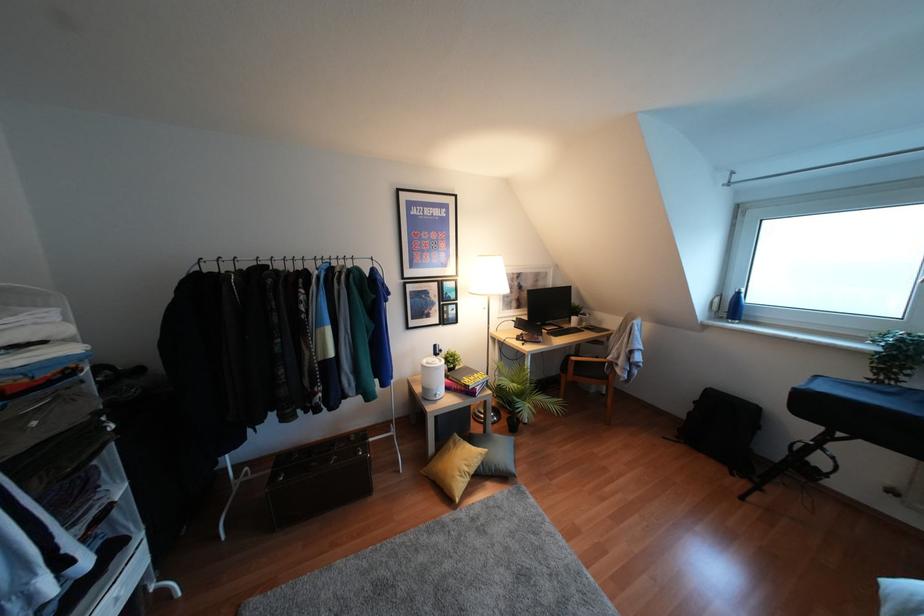
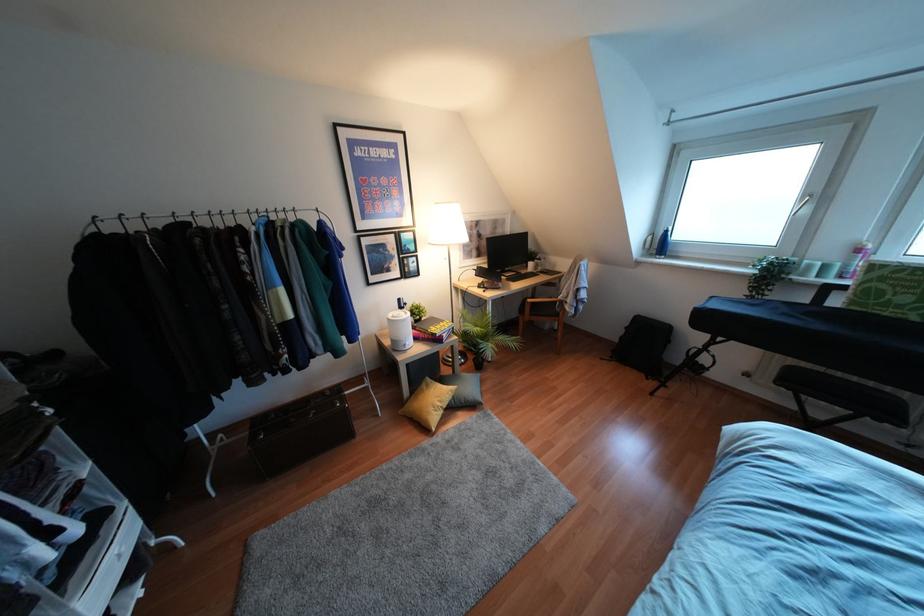
Find the pixel in the second image that matches point (688, 413) in the first image.

(621, 337)